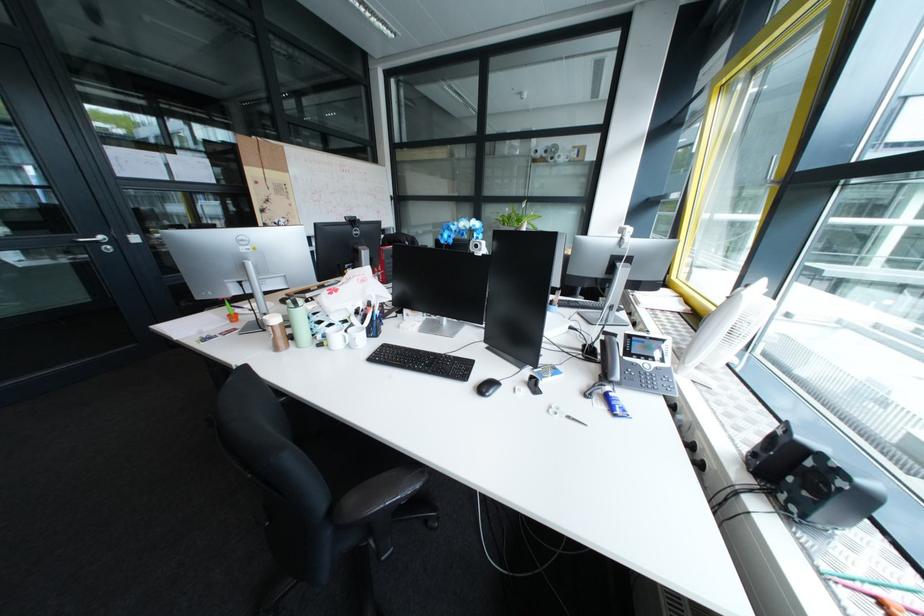
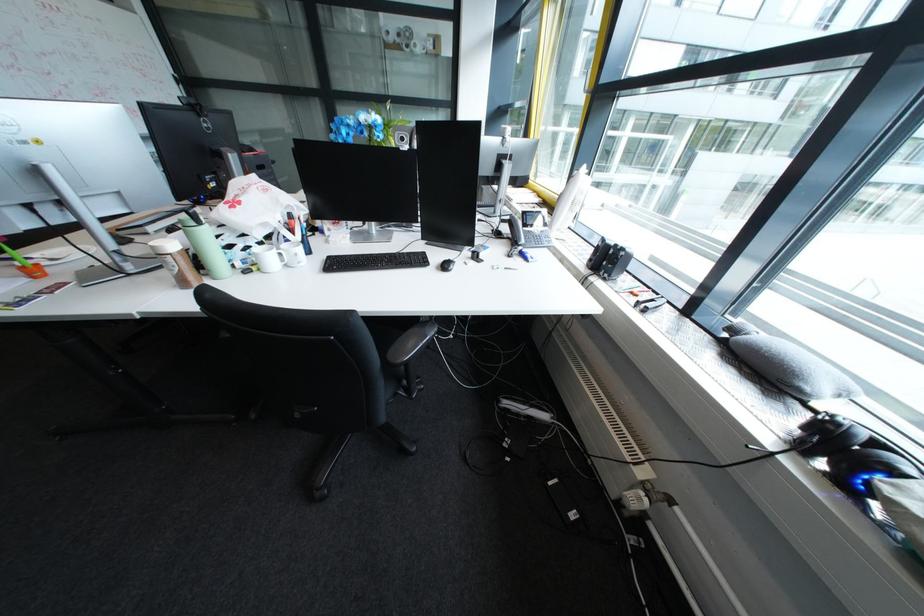
Find the pixel in the second image that matches (x=284, y=338) in the first image.

(187, 270)